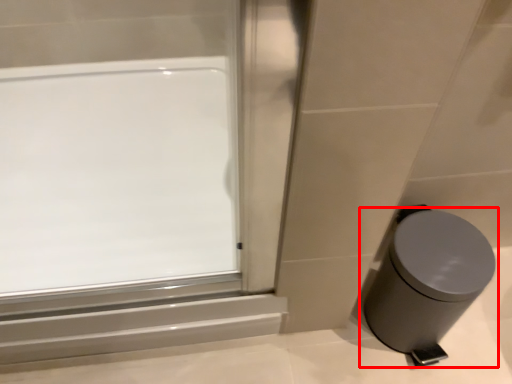
Question: From the image's perspective, considering the relative positions of waste container (annotated by the red box) and window in the image provided, where is waste container (annotated by the red box) located with respect to the staircase?

Choices:
 (A) above
 (B) below

Answer: (B)